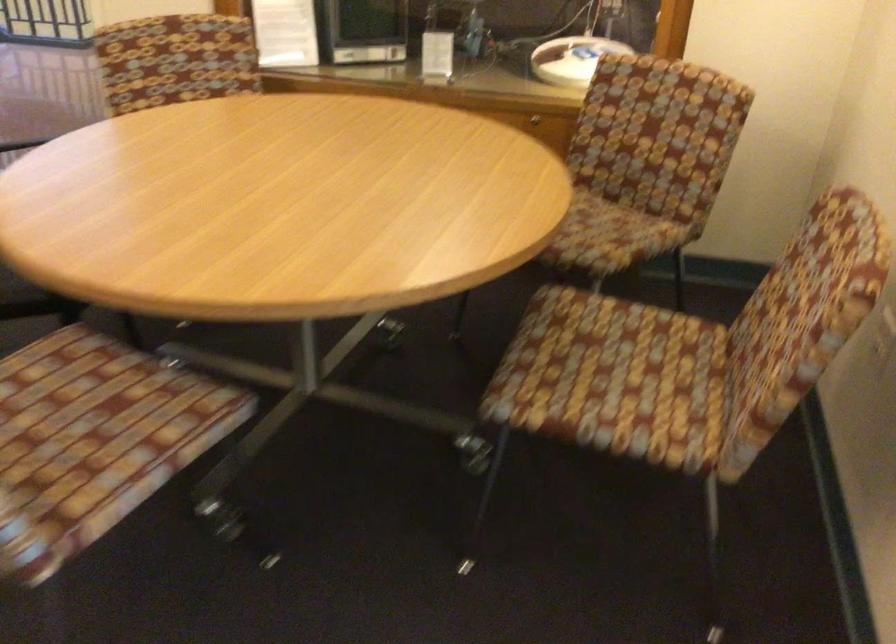
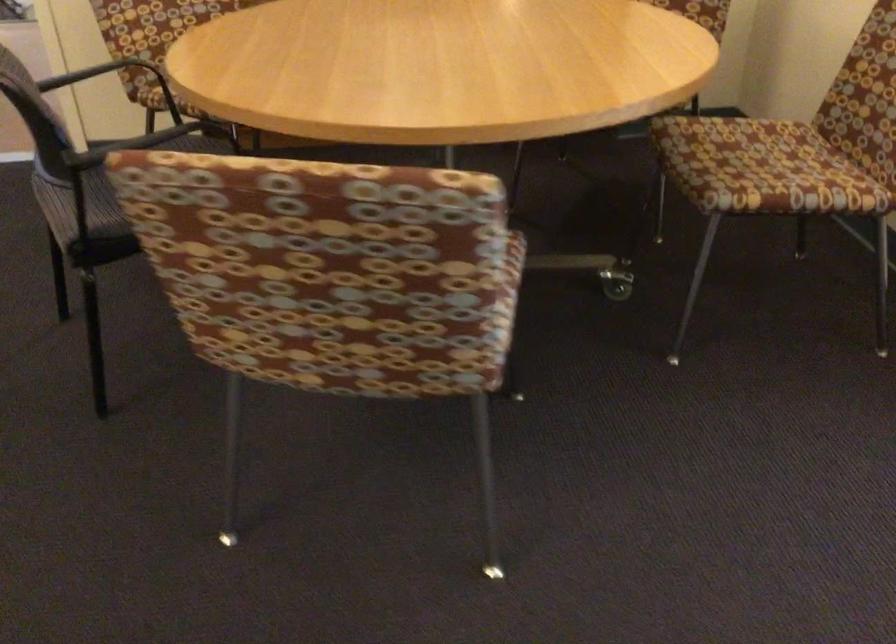
The point at (403, 408) is marked in the first image. Where is the corresponding point in the second image?

(546, 254)